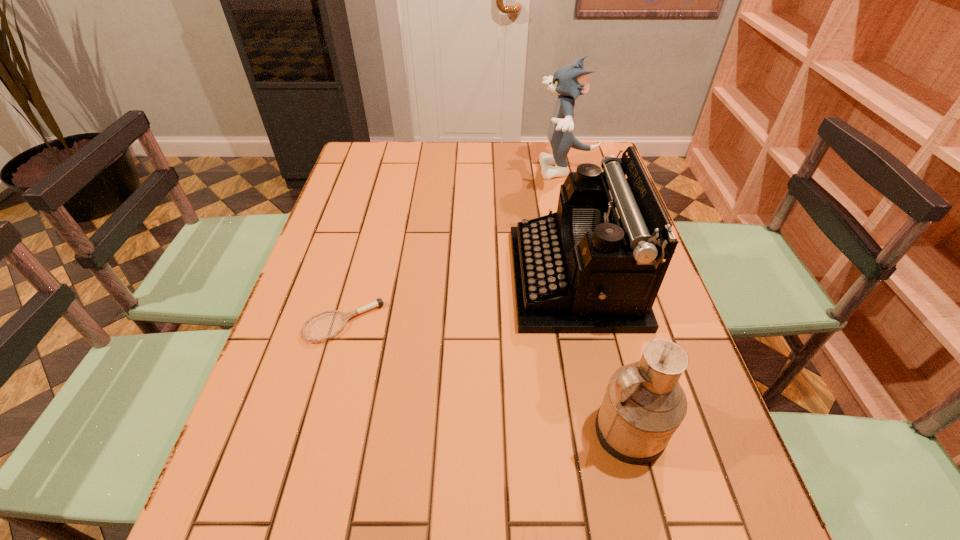
You are a GUI agent. You are given a task and a screenshot of the screen. Output one action in this format:
    pyautogui.click(x=<x>, y=<y>)
    Task: Click on the cat
    The width and height of the screenshot is (960, 540).
    Given the screenshot: What is the action you would take?
    pyautogui.click(x=568, y=82)

This screenshot has width=960, height=540. Identify the location of the tallest object. (568, 82).

The width and height of the screenshot is (960, 540). What are the coordinates of `typewriter` in the screenshot? It's located at pyautogui.click(x=596, y=265).

Identify the location of the nearest object. (644, 404).

Find the location of a particular element. The height and width of the screenshot is (540, 960). tennis racket is located at coordinates point(379,302).

The height and width of the screenshot is (540, 960). Identify the location of the shortest object. (379, 302).

Locate an element on the screen. free spot located on the front-facing side of the tallest object is located at coordinates (497, 169).

What are the coordinates of `free space located 0.050m on the front-facing side of the tallest object` in the screenshot? It's located at pos(524,169).

Identify the location of free space located on the front-facing side of the tallest object. The height and width of the screenshot is (540, 960). (465, 169).

Locate an element on the screen. vacant space situated on the typing side of the typewriter is located at coordinates (447, 278).